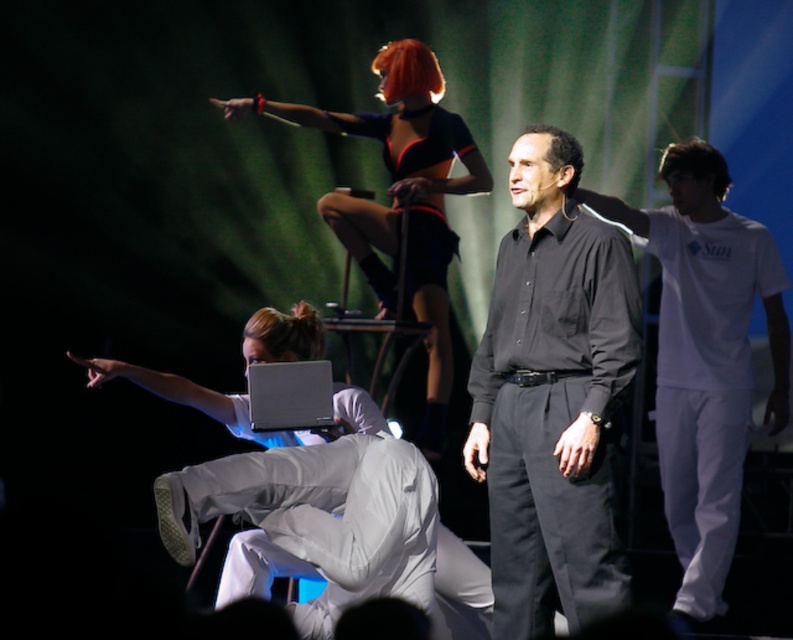
You are a photographer setting up for a photoshoot. You need to position a spotlight so that it illuminates both the black smooth shirt at center and the shiny black dress at upper center. Given their positions, which object should be placed to the right of the other to ensure proper lighting?

The black smooth shirt at center is positioned on the right side of shiny black dress at upper center, so to ensure proper lighting, the black smooth shirt at center should be placed to the right of the shiny black dress at upper center.

In the scene shown: You are a stage designer preparing for a performance. You need to place a spotlight on the stage. The spotlight can only illuminate objects that are not covered by any other object. Based on the scene, which object can the spotlight illuminate without obstruction? Please choose between the shiny black dress at upper center and the white matte laptop at center.

The white matte laptop at center can be illuminated without obstruction because it is positioned under the shiny black dress at upper center, meaning the dress is covering it. Therefore, the laptop is not obstructed from above, but since the dress is above it, the spotlight could shine on the laptop as long as there is no object in front blocking the light. Wait, but the description says the dress is over the laptop, so maybe the laptop is underneath and thus not visible. Hmm, need to clarify based on the

You are a photographer setting up for a photoshoot. The scene has a shiny black dress at upper center and a white matte laptop at center. Which object is wider?

The shiny black dress at upper center is wider than the white matte laptop at center.